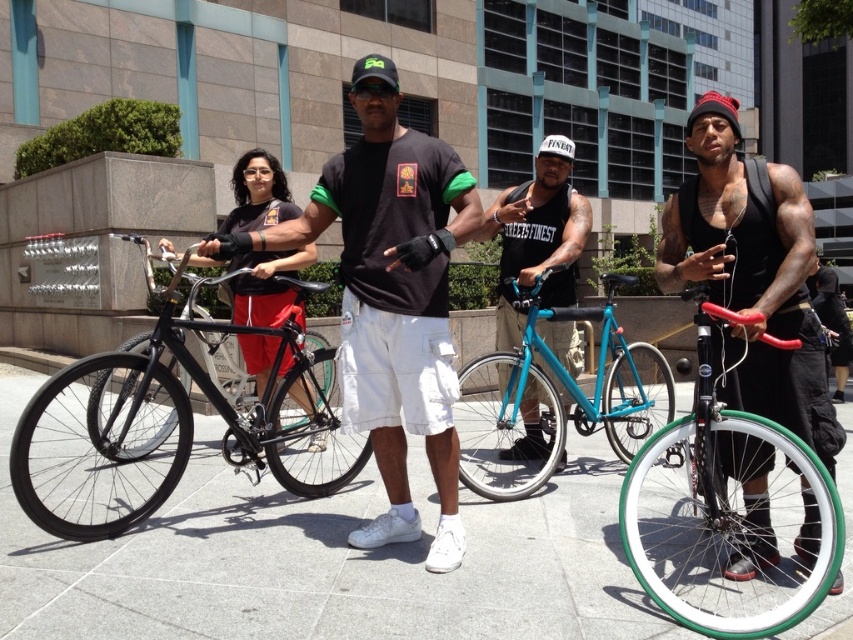
Question: Estimate the real-world distances between objects in this image. Which object is closer to the matte blue bicycle at center?

Choices:
 (A) matte black t-shirt at center
 (B) gray concrete pavement at center
 (C) green rubber bicycle at right
 (D) matte black bicycle at left

Answer: (A)

Question: Estimate the real-world distances between objects in this image. Which object is farther from the matte black t-shirt at center?

Choices:
 (A) matte black bicycle at left
 (B) black matte bicycle at left
 (C) teal glossy bicycle at center
 (D) green rubber bicycle at right

Answer: (C)

Question: Does gray concrete pavement at center appear under teal glossy bicycle at center?

Choices:
 (A) no
 (B) yes

Answer: (B)

Question: Is gray concrete pavement at center to the right of black matte bicycle at left from the viewer's perspective?

Choices:
 (A) yes
 (B) no

Answer: (A)

Question: Which point appears closest to the camera in this image?

Choices:
 (A) (485, 449)
 (B) (258, 157)
 (C) (405, 212)

Answer: (C)

Question: Does teal glossy bicycle at center have a lesser width compared to matte blue bicycle at center?

Choices:
 (A) no
 (B) yes

Answer: (A)